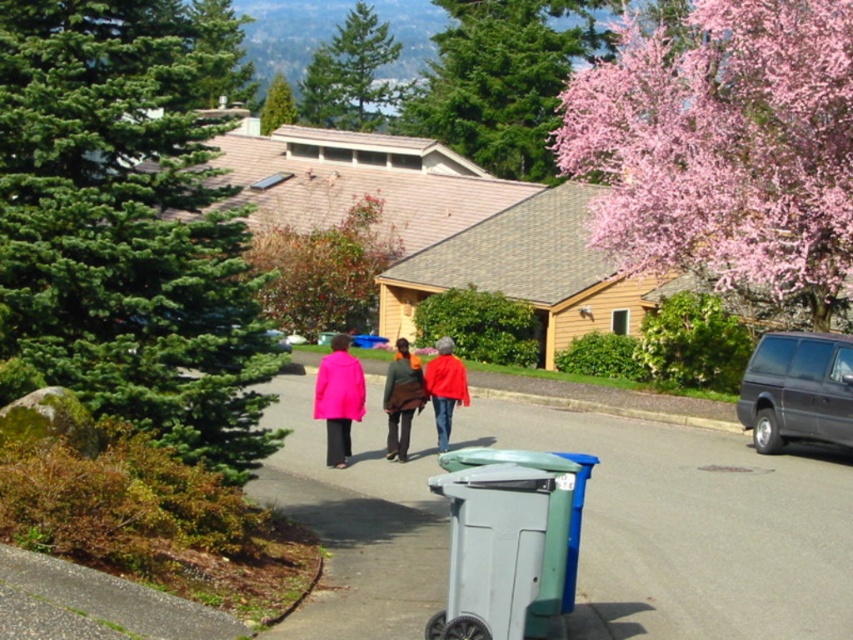
Question: Which object is the farthest from the green textured pine tree at left?

Choices:
 (A) green textured pine tree at upper center
 (B) pink matte coat at center
 (C) gray plastic trash can at lower center

Answer: (A)

Question: Does brown textured tree at upper center have a greater width compared to matte pink coat at center?

Choices:
 (A) yes
 (B) no

Answer: (A)

Question: Which object is farther from the camera taking this photo?

Choices:
 (A) gray plastic trash can at lower center
 (B) green textured evergreen tree at upper center

Answer: (B)

Question: Which of the following is the closest to the observer?

Choices:
 (A) pink matte coat at center
 (B) green textured pine tree at upper center
 (C) dark gray metallic van at right

Answer: (A)

Question: Considering the relative positions of pink blossoming tree at upper center and pink matte coat at center in the image provided, where is pink blossoming tree at upper center located with respect to pink matte coat at center?

Choices:
 (A) above
 (B) below

Answer: (A)

Question: Does brown textured tree at upper center appear on the right side of matte red jacket at center?

Choices:
 (A) no
 (B) yes

Answer: (A)